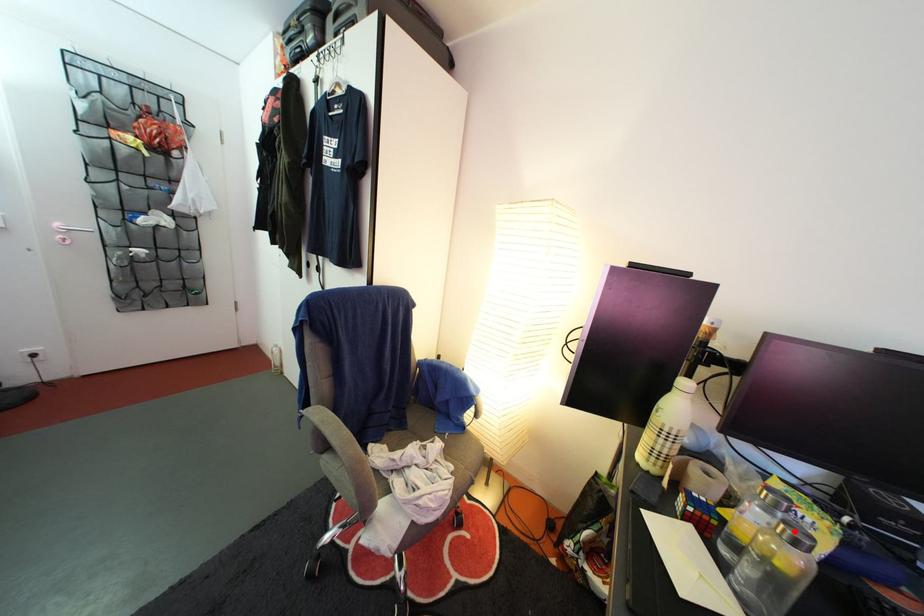
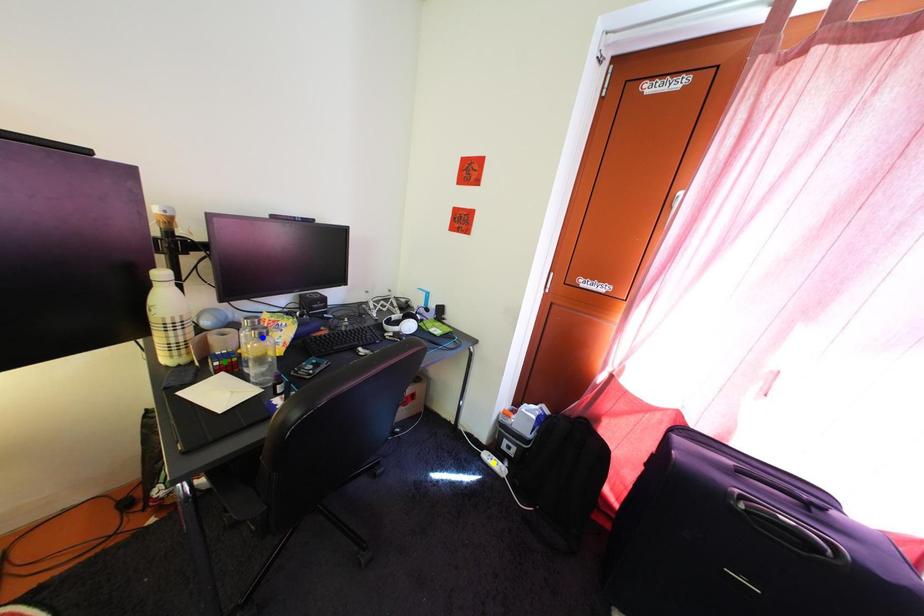
Question: I am providing you with two images of the same scene from different viewpoints. A red point is marked on the first image. You are given multiple points on the second image. In image 2, which mark is for the same physical point as the one in image 1?

Choices:
 (A) green point
 (B) blue point
 (C) yellow point

Answer: (B)